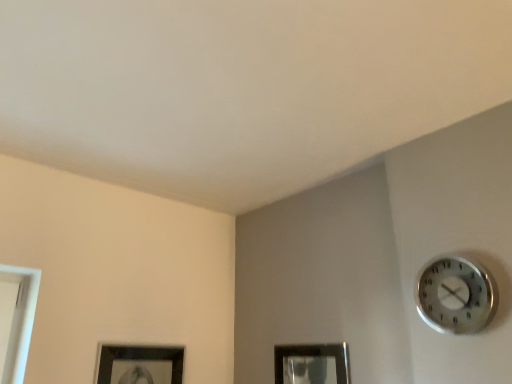
Question: From a real-world perspective, relative to silver metallic clock at upper right, is matte black picture frame at lower center vertically above or below?

Choices:
 (A) above
 (B) below

Answer: (B)

Question: Relative to silver metallic clock at upper right, is matte black picture frame at lower center in front or behind?

Choices:
 (A) behind
 (B) front

Answer: (A)

Question: From the image's perspective, is matte black picture frame at lower center above or below silver metallic clock at upper right?

Choices:
 (A) below
 (B) above

Answer: (A)

Question: In terms of size, does silver metallic clock at upper right appear bigger or smaller than matte black picture frame at lower center?

Choices:
 (A) small
 (B) big

Answer: (B)

Question: From the image's perspective, is silver metallic clock at upper right above or below matte black picture frame at lower center?

Choices:
 (A) above
 (B) below

Answer: (A)

Question: From their relative heights in the image, would you say silver metallic clock at upper right is taller or shorter than matte black picture frame at lower center?

Choices:
 (A) tall
 (B) short

Answer: (B)

Question: Considering the positions of silver metallic clock at upper right and matte black picture frame at lower center in the image, is silver metallic clock at upper right wider or thinner than matte black picture frame at lower center?

Choices:
 (A) thin
 (B) wide

Answer: (B)